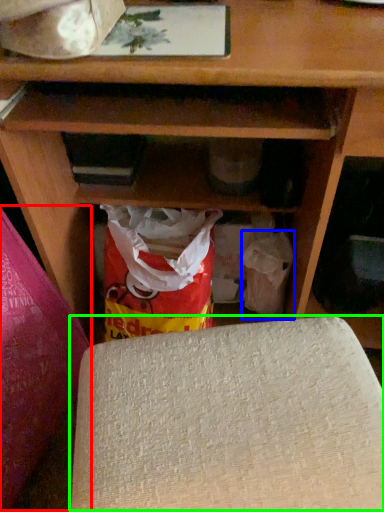
Question: Considering the real-world distances, which object is farthest from yoga mat (highlighted by a red box)? grocery bag (highlighted by a blue box) or yoga mat (highlighted by a green box)?

Choices:
 (A) grocery bag
 (B) yoga mat

Answer: (A)